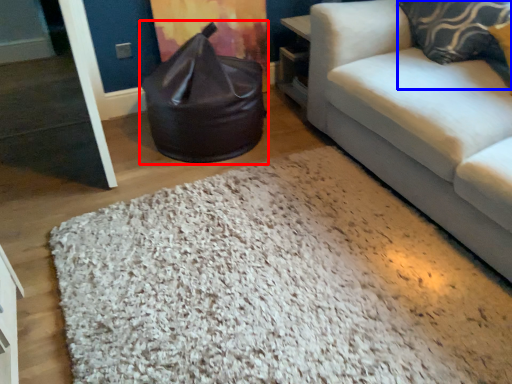
Question: Among these objects, which one is nearest to the camera, bean bag chair (highlighted by a red box) or pillow (highlighted by a blue box)?

Choices:
 (A) bean bag chair
 (B) pillow

Answer: (B)